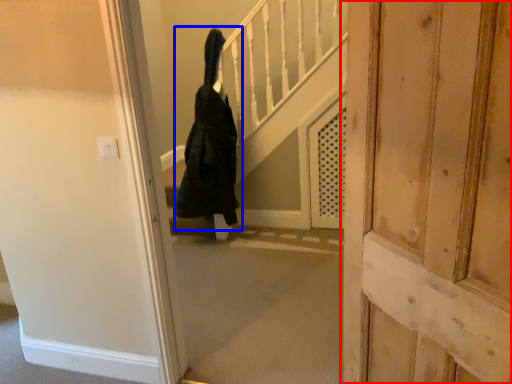
Question: Which object is closer to the camera taking this photo, door (highlighted by a red box) or person (highlighted by a blue box)?

Choices:
 (A) door
 (B) person

Answer: (A)